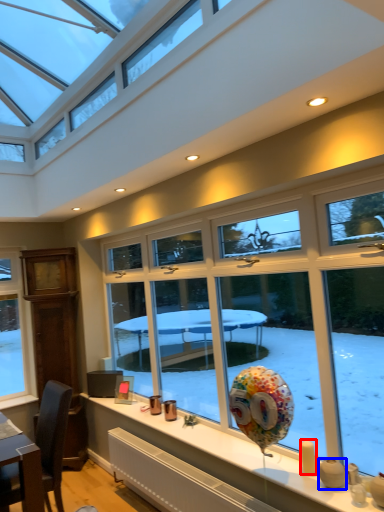
Question: Among these objects, which one is nearest to the camera, candle (highlighted by a red box) or candle holder (highlighted by a blue box)?

Choices:
 (A) candle
 (B) candle holder

Answer: (B)